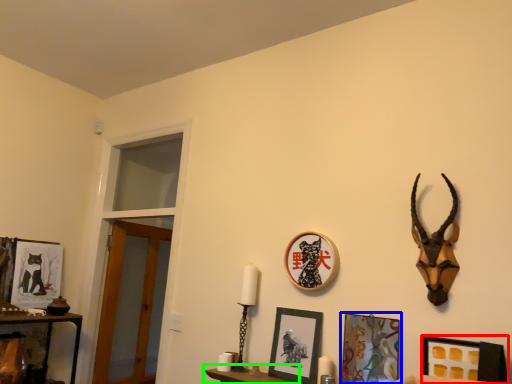
Question: Considering the real-world distances, which object is closest to picture frame (highlighted by a red box)? picture frame (highlighted by a blue box) or furniture (highlighted by a green box).

Choices:
 (A) picture frame
 (B) furniture

Answer: (A)